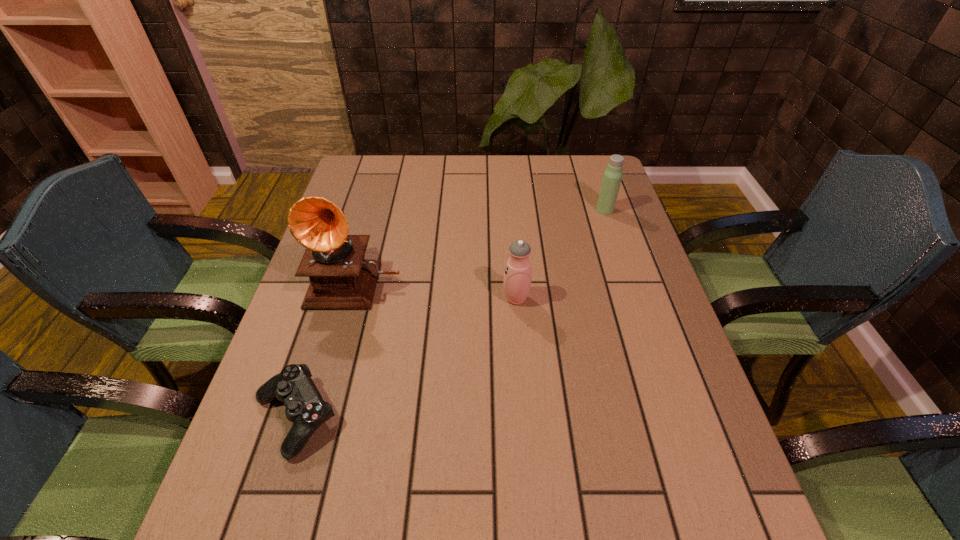
Where is `vacant point located between the nearest object and the phonograph record`? The image size is (960, 540). vacant point located between the nearest object and the phonograph record is located at coordinates (326, 349).

Where is `unoccupied position between the right thermos bottle and the left thermos bottle`? Image resolution: width=960 pixels, height=540 pixels. unoccupied position between the right thermos bottle and the left thermos bottle is located at coordinates (561, 254).

The image size is (960, 540). Find the location of `free spot between the farthest object and the phonograph record`. free spot between the farthest object and the phonograph record is located at coordinates (481, 246).

The image size is (960, 540). In order to click on vacant region between the second object from right to left and the control in this screenshot , I will do `click(406, 357)`.

The image size is (960, 540). Find the location of `free space between the nearer thermos bottle and the right thermos bottle`. free space between the nearer thermos bottle and the right thermos bottle is located at coordinates (561, 254).

Locate an element on the screen. Image resolution: width=960 pixels, height=540 pixels. free space between the tallest object and the nearer thermos bottle is located at coordinates (437, 290).

Locate which object is the second closest to the phonograph record. Please provide its 2D coordinates. Your answer should be formatted as a tuple, i.e. [(x, y)], where the tuple contains the x and y coordinates of a point satisfying the conditions above.

[(517, 277)]

Locate which object ranks third in proximity to the rightmost object. Please provide its 2D coordinates. Your answer should be formatted as a tuple, i.e. [(x, y)], where the tuple contains the x and y coordinates of a point satisfying the conditions above.

[(305, 408)]

This screenshot has width=960, height=540. Find the location of `vacant region that satisfies the following two spatial constraints: 1. on the back side of the control; 2. on the right side of the right thermos bottle`. vacant region that satisfies the following two spatial constraints: 1. on the back side of the control; 2. on the right side of the right thermos bottle is located at coordinates [361, 210].

You are a GUI agent. You are given a task and a screenshot of the screen. Output one action in this format:
    pyautogui.click(x=<x>, y=<y>)
    Task: Click on the vacant space that satisfies the following two spatial constraints: 1. on the horn of the tallest object; 2. on the right side of the left thermos bottle
    This screenshot has height=540, width=960.
    Given the screenshot: What is the action you would take?
    pyautogui.click(x=352, y=299)